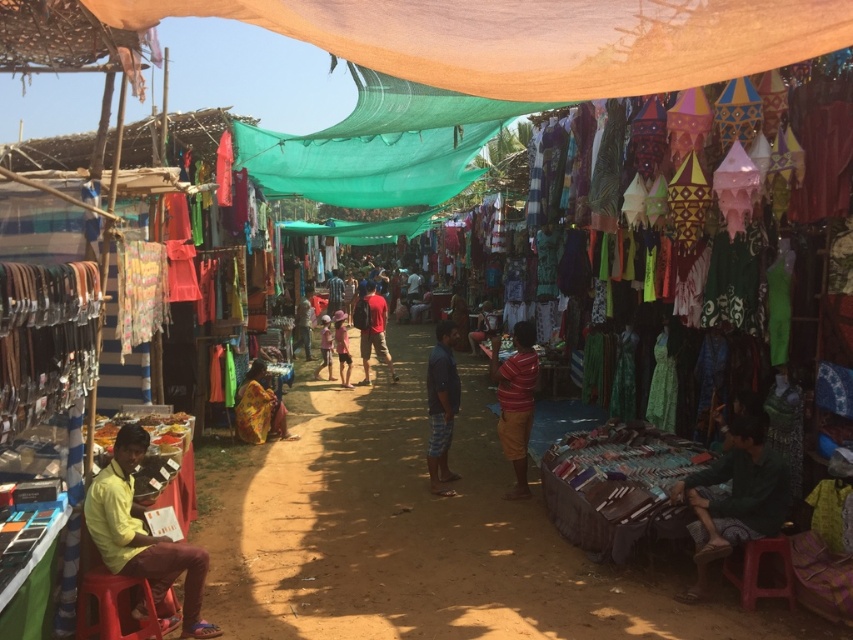
Question: Estimate the real-world distances between objects in this image. Which object is closer to the red fabric backpack at center?

Choices:
 (A) yellow plastic stool at lower left
 (B) green fabric at lower right
 (C) multicolored fabric at center
 (D) light pink fabric at center

Answer: (D)

Question: Can you confirm if multicolored fabric at center is bigger than light blue fabric at center?

Choices:
 (A) yes
 (B) no

Answer: (B)

Question: Which object is positioned closest to the striped shirt at center?

Choices:
 (A) yellow cotton shirt at lower left
 (B) light blue fabric at center
 (C) yellow plastic stool at lower left

Answer: (A)

Question: Among these points, which one is farthest from the camera?

Choices:
 (A) (518, 465)
 (B) (717, 483)

Answer: (A)

Question: Can you confirm if multicolored fabric at center is positioned below red fabric backpack at center?

Choices:
 (A) no
 (B) yes

Answer: (B)

Question: Does yellow plastic stool at lower left appear on the right side of light pink fabric at center?

Choices:
 (A) yes
 (B) no

Answer: (A)